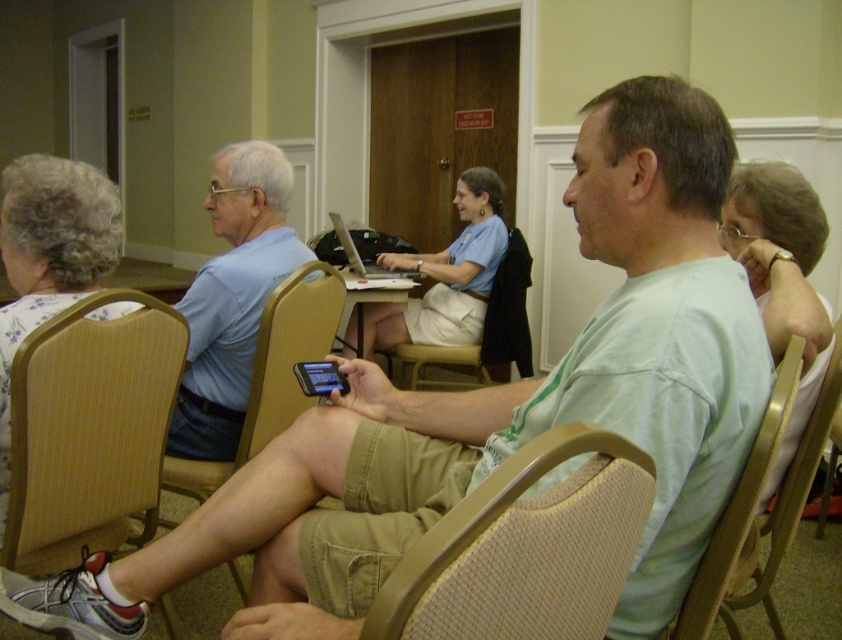
Between point (750, 176) and point (517, 358), which one is positioned behind?

Positioned behind is point (517, 358).

Describe the element at coordinates (773, 212) in the screenshot. I see `white fabric shirt at upper right` at that location.

The height and width of the screenshot is (640, 842). What are the coordinates of `white fabric shirt at upper right` in the screenshot? It's located at (773, 212).

Which is behind, point (536, 612) or point (526, 356)?

The point (526, 356) is more distant.

Between beige woven fabric chair at lower center and beige fabric chair at center, which one has more height?

beige fabric chair at center

Identify the location of beige woven fabric chair at lower center. The width and height of the screenshot is (842, 640). (525, 548).

Identify the location of beige woven fabric chair at lower center. The height and width of the screenshot is (640, 842). (525, 548).

Consider the image. Does tan fabric chair at lower center have a larger size compared to silver metallic laptop at center?

Indeed, tan fabric chair at lower center has a larger size compared to silver metallic laptop at center.

Is point (270, 328) in front of point (347, 252)?

Yes, point (270, 328) is in front of point (347, 252).

I want to click on tan fabric chair at lower center, so click(x=272, y=372).